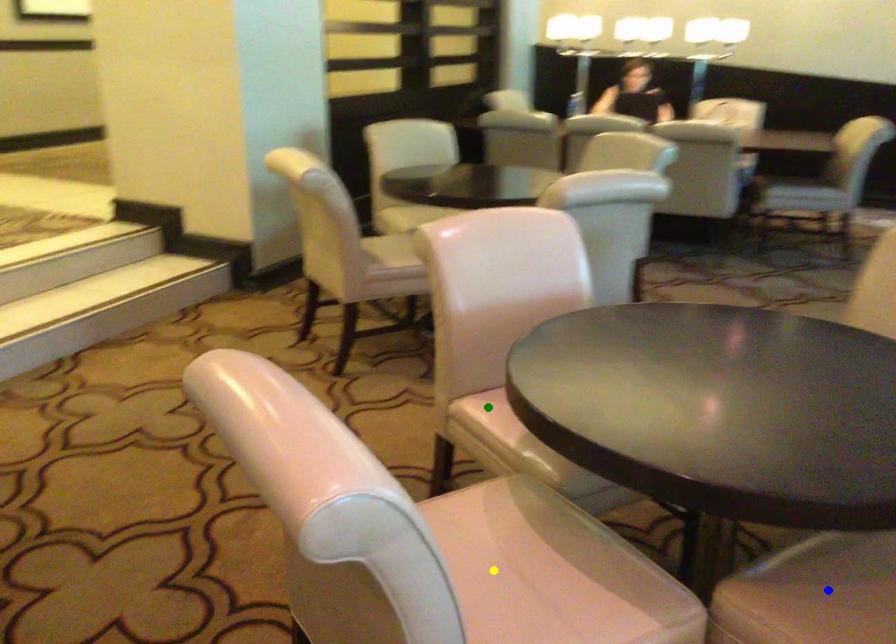
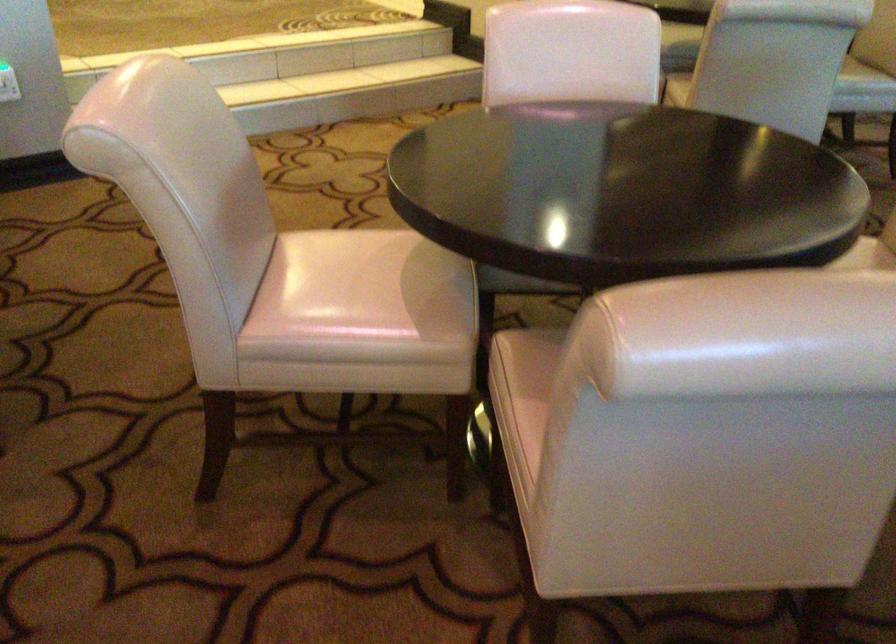
I am providing you with two images of the same scene from different viewpoints. Three points are marked in image1. Which point corresponds to a part or object that is occluded in image2?In image1, three points are marked. Which of them correspond to a part or object that is occluded in image2?Among the three points shown in image1, which one corresponds to a part or object that is no longer visible due to occlusion in image2?

Invisible in image2: green point, blue point.